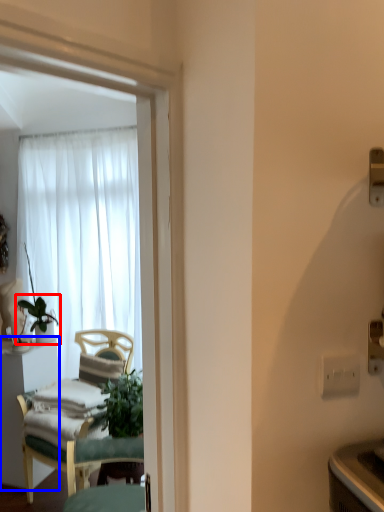
Question: Which object appears farthest to the camera in this image, houseplant (highlighted by a red box) or desk (highlighted by a blue box)?

Choices:
 (A) houseplant
 (B) desk

Answer: (A)